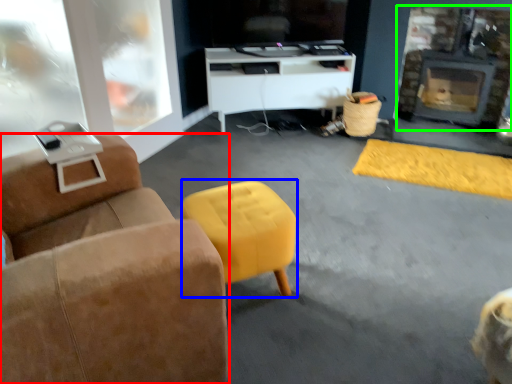
Question: Considering the real-world distances, which object is farthest from furniture (highlighted by a red box)? stool (highlighted by a blue box) or fireplace (highlighted by a green box)?

Choices:
 (A) stool
 (B) fireplace

Answer: (B)